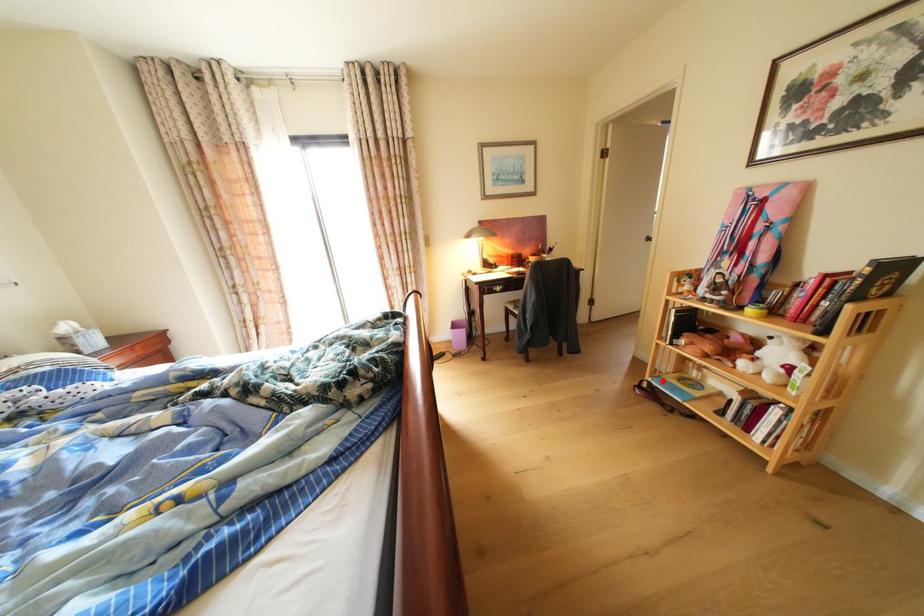
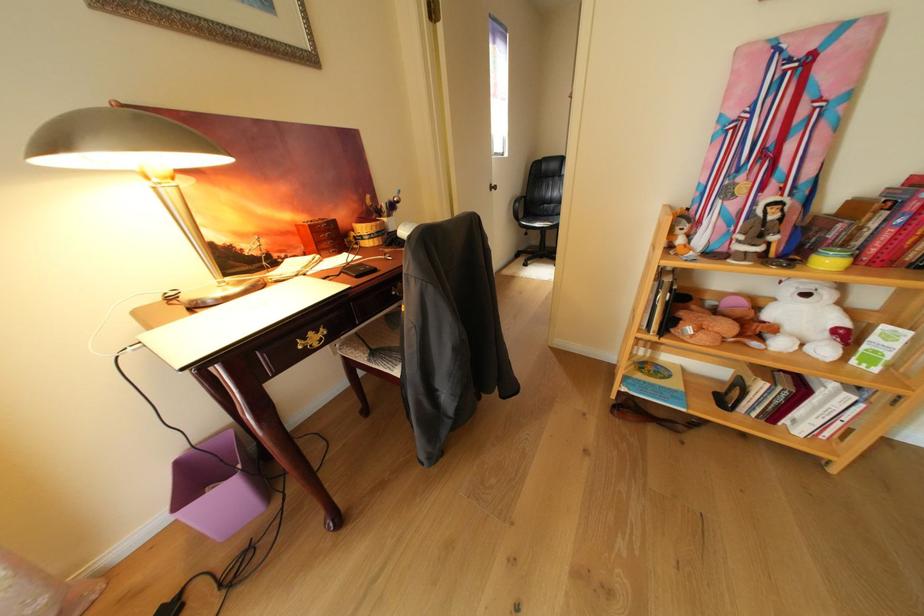
In the second image, find the point that corresponds to the highlighted location in the first image.

(638, 391)